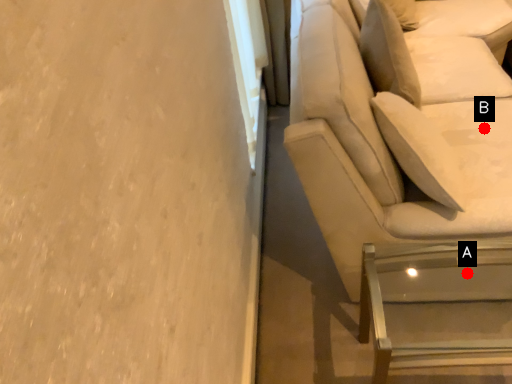
Question: Two points are circled on the image, labeled by A and B beside each circle. Which point appears closest to the camera in this image?

Choices:
 (A) A is closer
 (B) B is closer

Answer: (A)